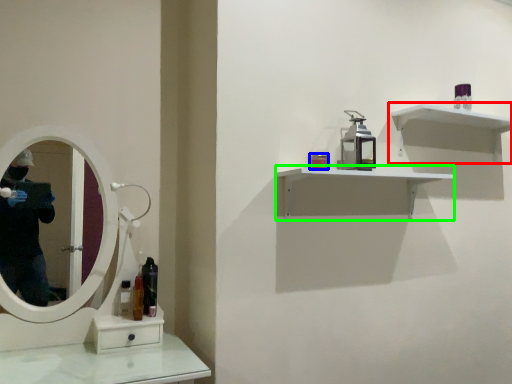
Question: Which object is the farthest from shelf (highlighted by a red box)? Choose among these: toiletry (highlighted by a blue box) or shelf (highlighted by a green box).

Choices:
 (A) toiletry
 (B) shelf

Answer: (A)